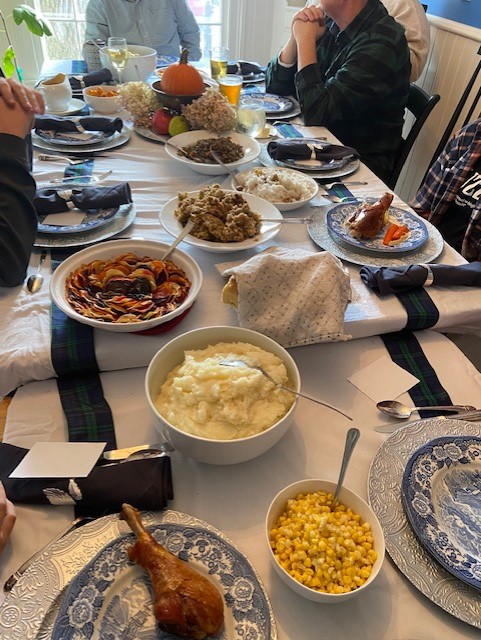
You are a GUI agent. You are given a task and a screenshot of the screen. Output one action in this format:
    pyautogui.click(x=<x>, y=<y>)
    Task: Click on the wrapped up napkin below carrot and chiken
    The image size is (481, 640).
    Given the screenshot: What is the action you would take?
    pyautogui.click(x=409, y=272)